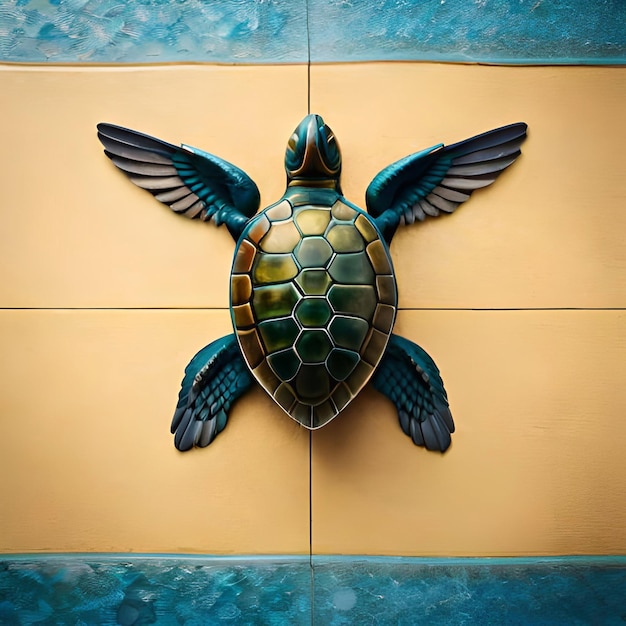
You are a GUI agent. You are given a task and a screenshot of the screen. Output one action in this format:
    pyautogui.click(x=<x>, y=<y>)
    Task: Click on the artwork
    Image resolution: width=626 pixels, height=626 pixels.
    Given the screenshot: What is the action you would take?
    pyautogui.click(x=331, y=283)